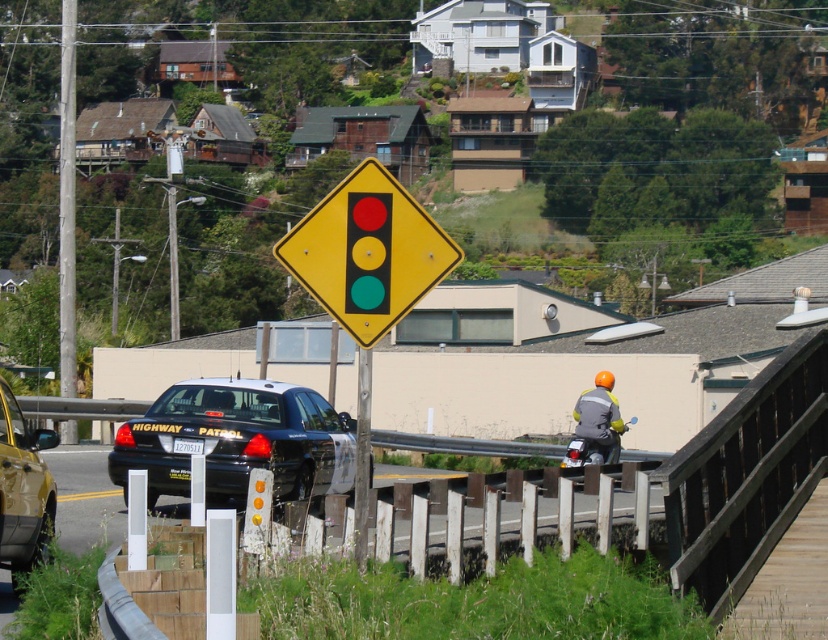
Does wooden post at left come behind metallic pole at center?

That is True.

Which is behind, point (63, 237) or point (354, 552)?

Positioned behind is point (63, 237).

Who is more distant from viewer, (70, 24) or (360, 547)?

Point (70, 24)

Find the location of `wooden post at left`. wooden post at left is located at coordinates (66, 202).

Locate an element on the screen. yellow diamond-shaped traffic sign at center is located at coordinates (367, 252).

Does yellow diamond-shaped traffic sign at center appear over wooden post at left?

No, yellow diamond-shaped traffic sign at center is not above wooden post at left.

Between point (378, 193) and point (71, 51), which one is positioned behind?

The point (71, 51) is more distant.

The image size is (828, 640). I want to click on yellow diamond-shaped traffic sign at center, so click(x=367, y=252).

Can you confirm if white glossy highway patrol car at center is positioned below yellow diamond-shaped traffic sign at center?

Yes.

Does white glossy highway patrol car at center appear over yellow diamond-shaped traffic sign at center?

Incorrect, white glossy highway patrol car at center is not positioned above yellow diamond-shaped traffic sign at center.

Where is `white glossy highway patrol car at center`? The width and height of the screenshot is (828, 640). white glossy highway patrol car at center is located at coordinates (237, 440).